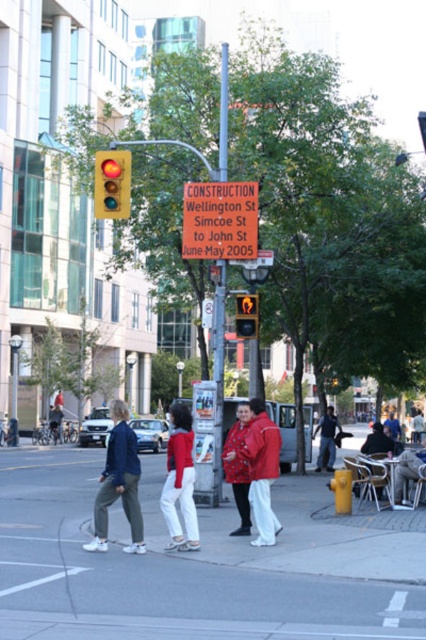
You are a delivery driver approaching the traffic lights and see the red plastic construction sign at center and the smooth gray statue at lower right. Which object is narrower?

The red plastic construction sign at center is thinner than the smooth gray statue at lower right, so the red plastic construction sign at center is narrower.

You are a drone operator trying to capture a photo of the yellow matte traffic light at upper left and the red fabric jacket at lower center in the same frame. Given that your drone camera has a maximum focal length that allows capturing objects up to 10 meters apart in the same shot, can you include both objects in a single photo?

The yellow matte traffic light at upper left and red fabric jacket at lower center are 12.87 meters apart, which exceeds the camera maximum focal length of 10 meters. Therefore, you cannot include both objects in a single photo.